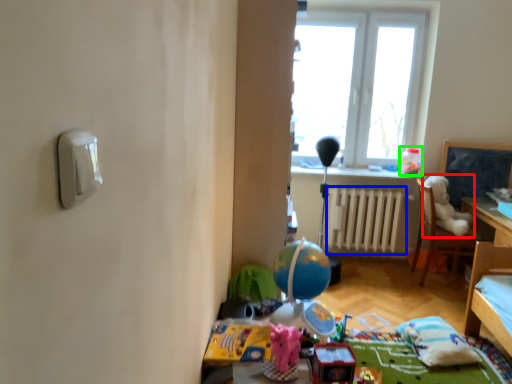
Question: Estimate the real-world distances between objects in this image. Which object is closer to animal (highlighted by a red box), radiator (highlighted by a blue box) or toy (highlighted by a green box)?

Choices:
 (A) radiator
 (B) toy

Answer: (B)